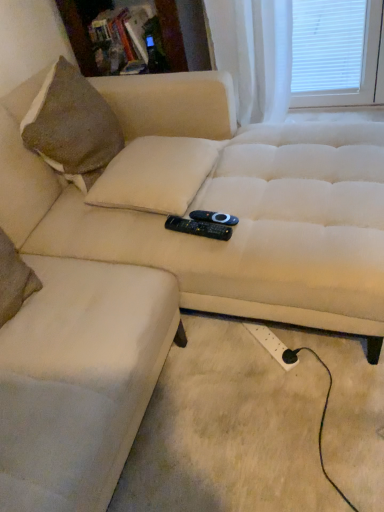
At what (x,y) coordinates should I click in order to perform the action: click on white matte window screen at upper right. Please return your answer as a coordinate pair (x, y). Looking at the image, I should click on (337, 53).

What is the approximate height of black plastic remote at center, the 2th remote from the bottom?

1.16 inches.

This screenshot has height=512, width=384. Identify the location of black plastic remote at center, the 1th remote positioned from the top. (214, 217).

What do you see at coordinates (80, 29) in the screenshot? This screenshot has height=512, width=384. I see `wooden bookshelf at upper center` at bounding box center [80, 29].

Find the location of `beige fabric pillow at center`. beige fabric pillow at center is located at coordinates (155, 175).

Does point (222, 222) lie behind point (281, 360)?

No, (222, 222) is in front of (281, 360).

Is black plastic remote at center, the 2th remote from the bottom, positioned with its back to white plastic extension cord at lower right?

black plastic remote at center, the 2th remote from the bottom, does not have its back to white plastic extension cord at lower right.

Is black plastic remote at center, the 2th remote from the bottom, next to white plastic extension cord at lower right and touching it?

No, black plastic remote at center, the 2th remote from the bottom, is not beside white plastic extension cord at lower right.

Is black plastic remote at center, the 2th remote from the bottom, placed right next to beige fabric ottoman at left?

black plastic remote at center, the 2th remote from the bottom, and beige fabric ottoman at left are not in contact.

Where is `the 2nd remote behind the beige fabric ottoman at left, starting your count from the anchor`? the 2nd remote behind the beige fabric ottoman at left, starting your count from the anchor is located at coordinates (x=214, y=217).

Who is shorter, black plastic remote at center, the 1th remote positioned from the top, or beige fabric ottoman at left?

black plastic remote at center, the 1th remote positioned from the top.

Based on the photo, is beige fabric pillow at center situated inside black plastic remote at center, which ranks as the 1th remote in bottom-to-top order, or outside?

beige fabric pillow at center exists outside the volume of black plastic remote at center, which ranks as the 1th remote in bottom-to-top order.

Identify the location of pillow on the left of black plastic remote at center, which ranks as the 1th remote in bottom-to-top order. The height and width of the screenshot is (512, 384). (155, 175).

Looking at their sizes, would you say beige fabric pillow at center is wider or thinner than black plastic remote at center, the second remote from the top?

Considering their sizes, beige fabric pillow at center looks broader than black plastic remote at center, the second remote from the top.

From a real-world perspective, which object rests below the other?

From a 3D spatial view, white matte window screen at upper right is below.

Considering the sizes of objects white matte window screen at upper right and white sheer curtain at upper right in the image provided, who is smaller, white matte window screen at upper right or white sheer curtain at upper right?

white matte window screen at upper right.

Is white matte window screen at upper right wider or thinner than white sheer curtain at upper right?

In the image, white matte window screen at upper right appears to be more narrow than white sheer curtain at upper right.

Are white matte window screen at upper right and white sheer curtain at upper right located far from each other?

No, there isn't a large distance between white matte window screen at upper right and white sheer curtain at upper right.

Locate an element on the screen. the 1st remote to the right of the wooden bookshelf at upper center, counting from the anchor's position is located at coordinates (200, 226).

Is wooden bookshelf at upper center oriented towards black plastic remote at center, the second remote from the top?

Yes, wooden bookshelf at upper center is aimed at black plastic remote at center, the second remote from the top.

Which of these two, wooden bookshelf at upper center or black plastic remote at center, the second remote from the top, stands shorter?

black plastic remote at center, the second remote from the top.

Does beige fabric pillow at center contain wooden bookshelf at upper center?

Definitely not — wooden bookshelf at upper center is not inside beige fabric pillow at center.

In the image, is beige fabric pillow at center positioned in front of or behind wooden bookshelf at upper center?

Visually, beige fabric pillow at center is located in front of wooden bookshelf at upper center.

How different are the orientations of beige fabric pillow at center and wooden bookshelf at upper center in degrees?

84.2 degrees separate the facing orientations of beige fabric pillow at center and wooden bookshelf at upper center.

Which is behind, point (155, 160) or point (162, 20)?

The point (162, 20) is farther from the camera.

From the picture: Can you tell me how much black plastic remote at center, the second remote from the top, and white matte window screen at upper right differ in facing direction?

They differ by 81.1 degrees in their facing directions.

Consider the image. Which object is wider, black plastic remote at center, the second remote from the top, or white matte window screen at upper right?

Wider between the two is black plastic remote at center, the second remote from the top.

From a real-world perspective, is black plastic remote at center, the second remote from the top, below white matte window screen at upper right?

No, from a real-world perspective, black plastic remote at center, the second remote from the top, is not under white matte window screen at upper right.

Considering the positions of points (206, 214) and (304, 101), is point (206, 214) closer to camera compared to point (304, 101)?

Yes.

Find the location of `remote that is the 2nd one when counting upward from the white plastic extension cord at lower right (from the image's perspective)`. remote that is the 2nd one when counting upward from the white plastic extension cord at lower right (from the image's perspective) is located at coordinates (214, 217).

Which remote is the 2nd one when counting from the right side of the beige fabric ottoman at left? Please provide its 2D coordinates.

[(214, 217)]

Estimate the real-world distances between objects in this image. Which object is closer to white plastic extension cord at lower right, black plastic remote at center, which ranks as the 1th remote in bottom-to-top order, or beige fabric ottoman at left?

The object closer to white plastic extension cord at lower right is black plastic remote at center, which ranks as the 1th remote in bottom-to-top order.

Estimate the real-world distances between objects in this image. Which object is closer to white plastic extension cord at lower right, black plastic remote at center, the 1th remote positioned from the top, or black plastic remote at center, which ranks as the 1th remote in bottom-to-top order?

black plastic remote at center, which ranks as the 1th remote in bottom-to-top order, is closer to white plastic extension cord at lower right.

From the image, which object appears to be nearer to white plastic extension cord at lower right, black plastic remote at center, the second remote from the top, or black plastic remote at center, the 1th remote positioned from the top?

black plastic remote at center, the second remote from the top, is closer to white plastic extension cord at lower right.

Considering their positions, is white plastic extension cord at lower right positioned further to white matte window screen at upper right than white sheer curtain at upper right?

white plastic extension cord at lower right.

When comparing their distances from wooden bookshelf at upper center, does white matte window screen at upper right or white plastic extension cord at lower right seem further?

white plastic extension cord at lower right is further to wooden bookshelf at upper center.

Which object lies nearer to the anchor point white sheer curtain at upper right, beige fabric pillow at center or beige fabric ottoman at left?

beige fabric pillow at center is closer to white sheer curtain at upper right.

From the image, which object appears to be farther from beige fabric pillow at center, white plastic extension cord at lower right or beige fabric ottoman at left?

The object further to beige fabric pillow at center is white plastic extension cord at lower right.

Considering their positions, is wooden bookshelf at upper center positioned closer to white sheer curtain at upper right than beige fabric pillow at center?

wooden bookshelf at upper center lies closer to white sheer curtain at upper right than the other object.

Locate an element on the screen. The height and width of the screenshot is (512, 384). bookshelf that lies between white matte window screen at upper right and black plastic remote at center, the 2th remote from the bottom, from top to bottom is located at coordinates (80, 29).

Locate an element on the screen. The image size is (384, 512). swivel chair between wooden bookshelf at upper center and white plastic extension cord at lower right vertically is located at coordinates (79, 380).

This screenshot has height=512, width=384. What are the coordinates of `remote between beige fabric ottoman at left and black plastic remote at center, the 2th remote from the bottom, in the front-back direction` in the screenshot? It's located at (200, 226).

Identify the location of curtain between white matte window screen at upper right and black plastic remote at center, which ranks as the 1th remote in bottom-to-top order, in the vertical direction. This screenshot has height=512, width=384. (254, 54).